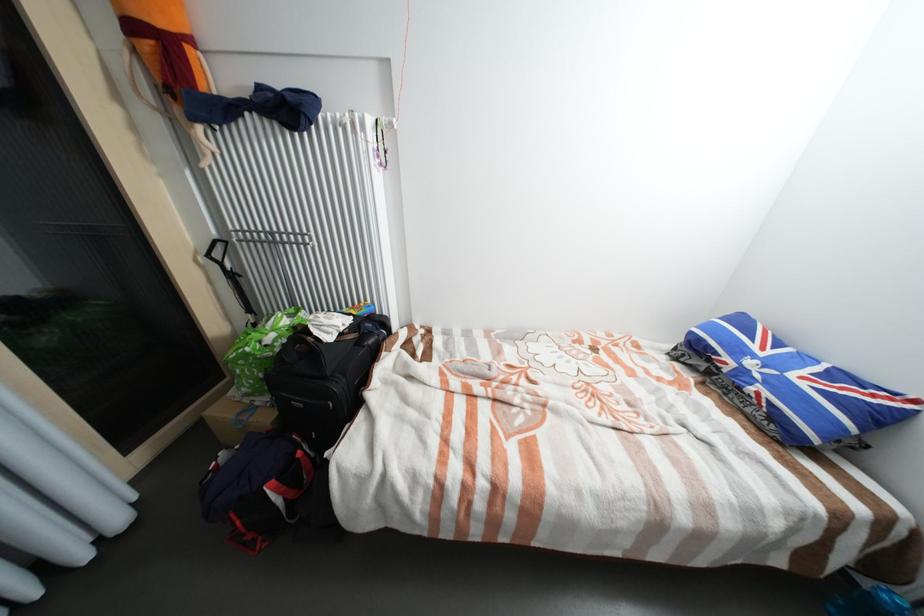
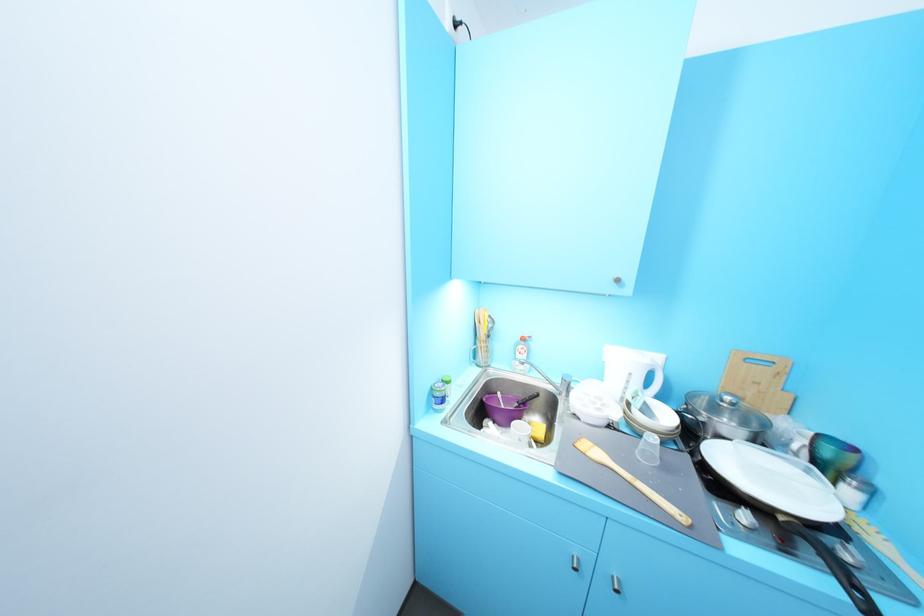
Question: I am providing you with two images of the same scene from different viewpoints. Please identify which objects are invisible in image2.

Choices:
 (A) black speaker device
 (B) silver cabinet handle
 (C) black pan handle
 (D) black luggage handle

Answer: (D)